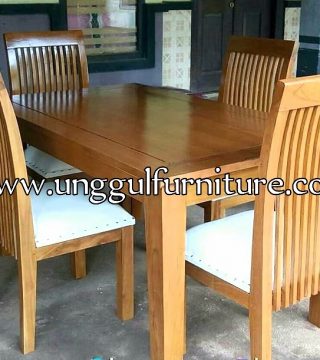
This screenshot has width=320, height=360. I want to click on column, so click(x=181, y=38), click(x=294, y=25).